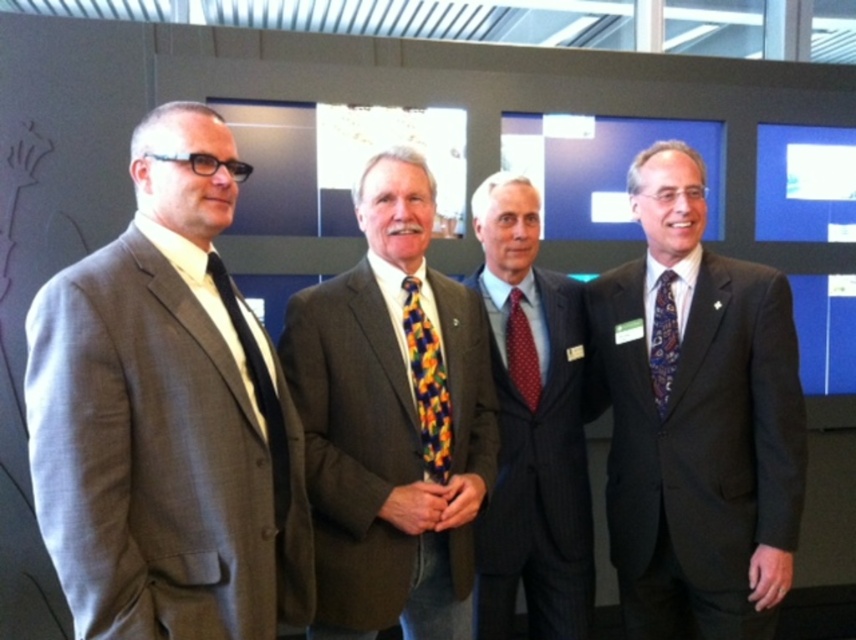
Question: Considering the relative positions of gray wool suit at left and red dotted tie at center in the image provided, where is gray wool suit at left located with respect to red dotted tie at center?

Choices:
 (A) right
 (B) left

Answer: (B)

Question: Is multicolored patterned tie at center to the right of floral silk tie at center from the viewer's perspective?

Choices:
 (A) no
 (B) yes

Answer: (A)

Question: Which object appears closest to the camera in this image?

Choices:
 (A) red dotted tie at center
 (B) matte black tie at left
 (C) pinstriped wool suit at center

Answer: (B)

Question: Is gray wool suit at left further to the viewer compared to pinstriped wool suit at center?

Choices:
 (A) yes
 (B) no

Answer: (B)

Question: Which point is closer to the camera taking this photo?

Choices:
 (A) (284, 513)
 (B) (516, 371)

Answer: (A)

Question: Based on their relative distances, which object is farther from the multicolored patterned tie at center?

Choices:
 (A) pinstriped wool suit at center
 (B) gray wool suit at left
 (C) blue patterned tie at right

Answer: (C)